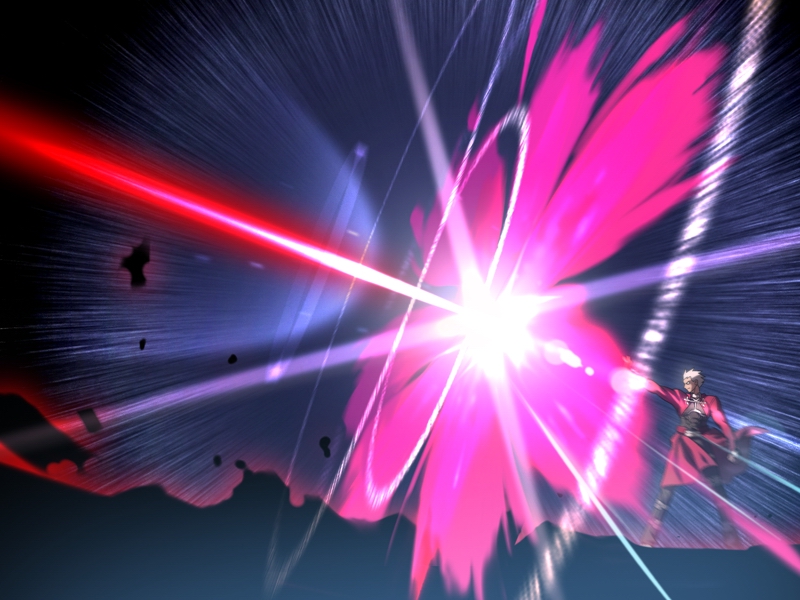
The width and height of the screenshot is (800, 600). I want to click on light, so (x=474, y=292).